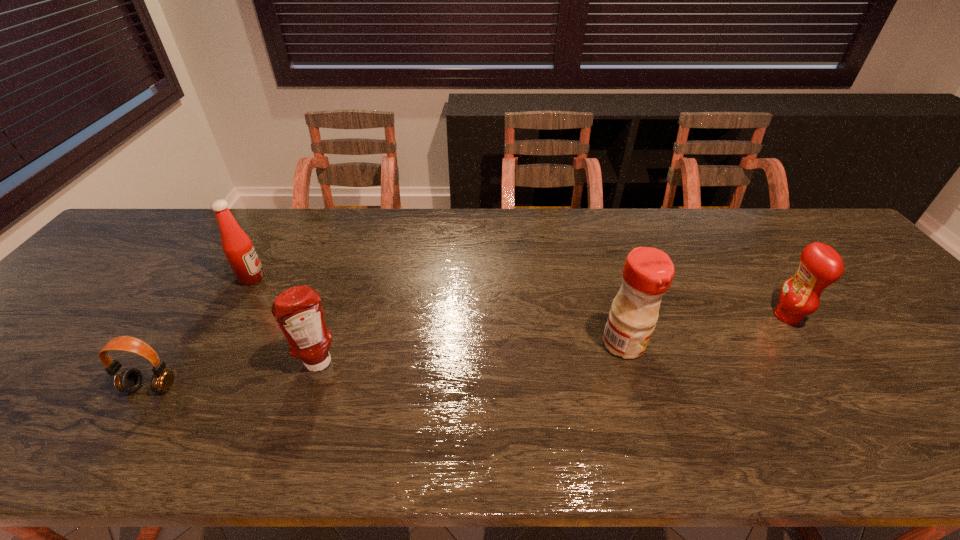
Where is `vacant region located 0.330m on the label side of the rightmost object`? This screenshot has width=960, height=540. vacant region located 0.330m on the label side of the rightmost object is located at coordinates (643, 316).

The height and width of the screenshot is (540, 960). What are the coordinates of `free point located 0.350m on the label side of the rightmost object` in the screenshot? It's located at (636, 316).

This screenshot has height=540, width=960. Find the location of `free space located 0.050m on the ear cups of the shortest object`. free space located 0.050m on the ear cups of the shortest object is located at coordinates click(131, 418).

In the image, there is a desktop. Where is `free region at the far edge`? This screenshot has height=540, width=960. free region at the far edge is located at coordinates (599, 248).

You are a GUI agent. You are given a task and a screenshot of the screen. Output one action in this format:
    pyautogui.click(x=<x>, y=<y>)
    Task: Click on the free space at the near edge of the desktop
    
    Given the screenshot: What is the action you would take?
    pyautogui.click(x=64, y=449)

Where is `free space at the left edge of the desktop`? The width and height of the screenshot is (960, 540). free space at the left edge of the desktop is located at coordinates (112, 272).

You are a GUI agent. You are given a task and a screenshot of the screen. Output one action in this format:
    pyautogui.click(x=<x>, y=<y>)
    Task: Click on the vacant space at the far right corner of the desktop
    Image resolution: width=960 pixels, height=540 pixels.
    Given the screenshot: What is the action you would take?
    pyautogui.click(x=820, y=217)

Find the location of a particular element. empty space that is in between the shortest object and the farthest object is located at coordinates (202, 333).

Find the location of a particular element. The height and width of the screenshot is (540, 960). free point between the third condiment from right to left and the third condiment from left to right is located at coordinates (472, 354).

Find the location of a particular element. The width and height of the screenshot is (960, 540). free spot between the second object from right to left and the rightmost object is located at coordinates (706, 330).